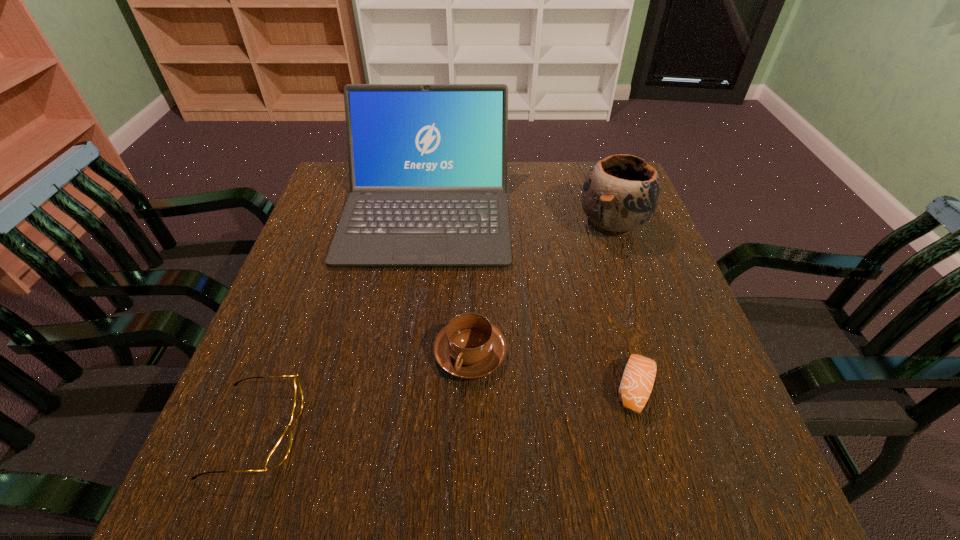
Image resolution: width=960 pixels, height=540 pixels. Identify the location of vacant space that satisfies the following two spatial constraints: 1. on the screen of the laptop computer; 2. on the right side of the fourth shortest object. (425, 223).

In order to click on vacant space that satisfies the following two spatial constraints: 1. on the screen of the tallest object; 2. on the front-facing side of the spectacles in this screenshot , I will do `click(396, 430)`.